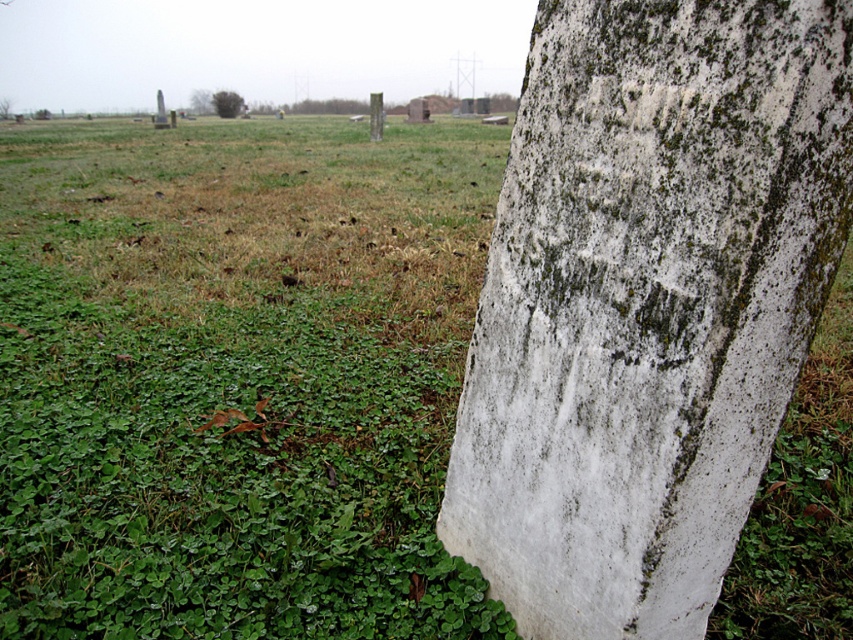
Question: Is white weathered stone at center to the left of green mossy tree at upper left from the viewer's perspective?

Choices:
 (A) no
 (B) yes

Answer: (A)

Question: Considering the relative positions of white weathered stone at center and green mossy tree at upper left in the image provided, where is white weathered stone at center located with respect to green mossy tree at upper left?

Choices:
 (A) right
 (B) left

Answer: (A)

Question: Is white weathered stone at center bigger than green mossy tree at upper left?

Choices:
 (A) no
 (B) yes

Answer: (B)

Question: Which point is closer to the camera?

Choices:
 (A) (740, 365)
 (B) (242, 109)

Answer: (A)